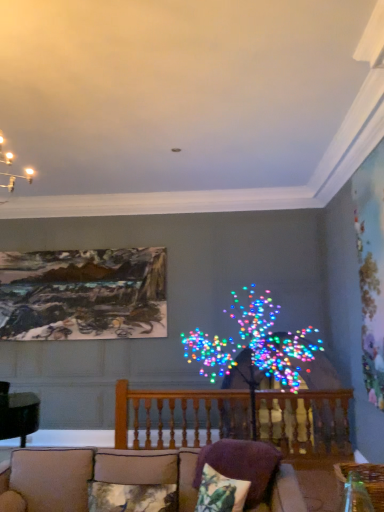
Question: From a real-world perspective, is fluffy fabric pillow at lower center, marked as the third pillow in a right-to-left arrangement, physically below wooden railing at center?

Choices:
 (A) yes
 (B) no

Answer: (A)

Question: Is fluffy fabric pillow at lower center, marked as the third pillow in a right-to-left arrangement, shorter than wooden railing at center?

Choices:
 (A) yes
 (B) no

Answer: (A)

Question: Does fluffy fabric pillow at lower center, marked as the third pillow in a right-to-left arrangement, come in front of wooden railing at center?

Choices:
 (A) yes
 (B) no

Answer: (A)

Question: From the image's perspective, is fluffy fabric pillow at lower center, marked as the third pillow in a right-to-left arrangement, on wooden railing at center?

Choices:
 (A) yes
 (B) no

Answer: (A)

Question: Can you confirm if fluffy fabric pillow at lower center, which ranks as the 1th pillow in left-to-right order, is bigger than wooden railing at center?

Choices:
 (A) yes
 (B) no

Answer: (B)

Question: Considering the relative sizes of floral fabric pillow at lower center, the 2th pillow when ordered from left to right, and oil painting at upper left in the image provided, is floral fabric pillow at lower center, the 2th pillow when ordered from left to right, bigger than oil painting at upper left?

Choices:
 (A) yes
 (B) no

Answer: (B)

Question: Can you confirm if floral fabric pillow at lower center, the 2th pillow when ordered from left to right, is thinner than oil painting at upper left?

Choices:
 (A) no
 (B) yes

Answer: (A)

Question: Is floral fabric pillow at lower center, placed as the 2th pillow when sorted from right to left, positioned behind oil painting at upper left?

Choices:
 (A) yes
 (B) no

Answer: (B)

Question: Does floral fabric pillow at lower center, placed as the 2th pillow when sorted from right to left, touch oil painting at upper left?

Choices:
 (A) yes
 (B) no

Answer: (B)

Question: Does floral fabric pillow at lower center, the 2th pillow when ordered from left to right, come in front of oil painting at upper left?

Choices:
 (A) yes
 (B) no

Answer: (A)

Question: Is beige fabric couch at lower center thinner than wooden railing at center?

Choices:
 (A) yes
 (B) no

Answer: (B)